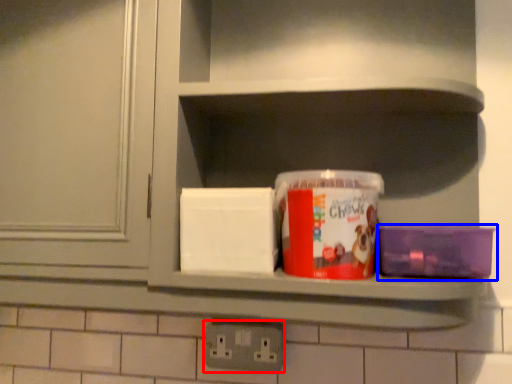
Question: Which point is further to the camera, electric outlet (highlighted by a red box) or box (highlighted by a blue box)?

Choices:
 (A) electric outlet
 (B) box

Answer: (A)